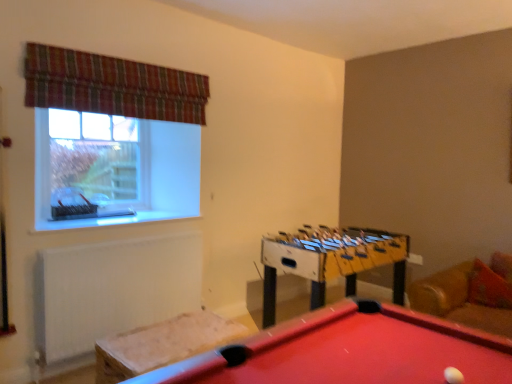
Locate an element on the screen. vacant area on top of white matte radiator at lower left (from a real-world perspective) is located at coordinates (131, 232).